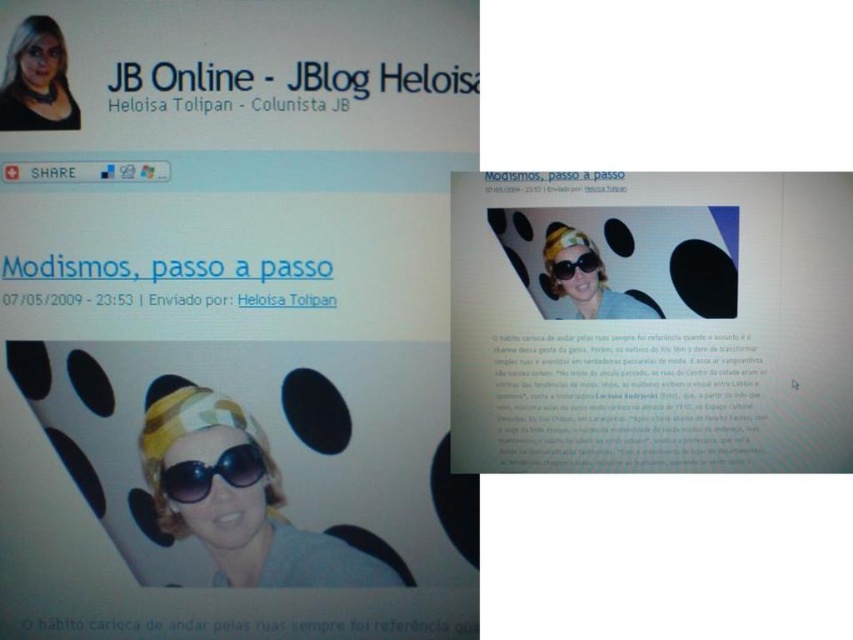
You are designing a costume for a play and need to choose between the yellow fabric headband at center and the matte yellow goggles at center. Based on their sizes, which one would you pick if you want the accessory to be more prominent?

The yellow fabric headband at center is larger in size than the matte yellow goggles at center, so it would be more prominent and suitable for the costume.

You are a fashion designer looking at the webpage and want to create a layered look using the yellow fabric headband at center and the matte yellow goggles at center. Which item should you place on top to ensure the goggles are visible?

The yellow fabric headband at center is in front of the matte yellow goggles at center, so to ensure the goggles are visible, place the matte yellow goggles at center on top of the yellow fabric headband at center.

You are a photographer standing 32.12 inches away from the matte black goggles at center. You want to take a photo of the goggles while ensuring they appear sharp in the image. Considering the depth of field, what adjustment should you make to your camera settings?

Since the matte black goggles at center are 32.12 inches away from the camera, you should adjust the aperture to a smaller fstop number to decrease the depth of field, ensuring the goggles remain sharp while the background becomes slightly blurred.